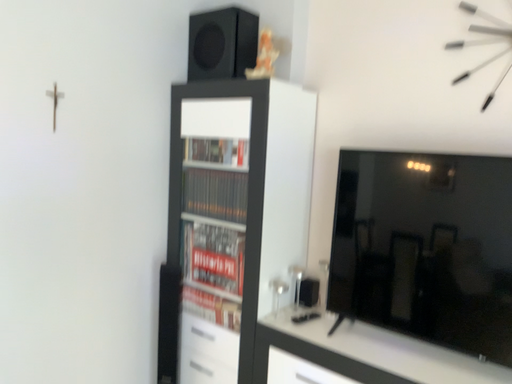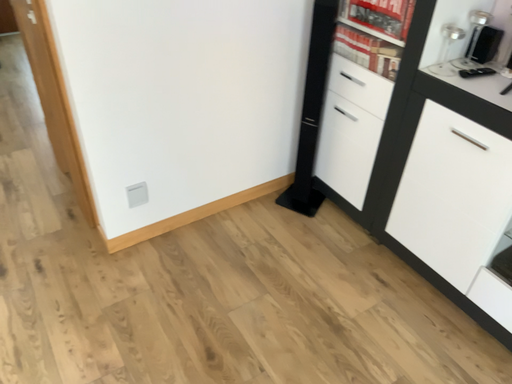
Question: How did the camera likely rotate when shooting the video?

Choices:
 (A) rotated downward
 (B) rotated upward

Answer: (A)